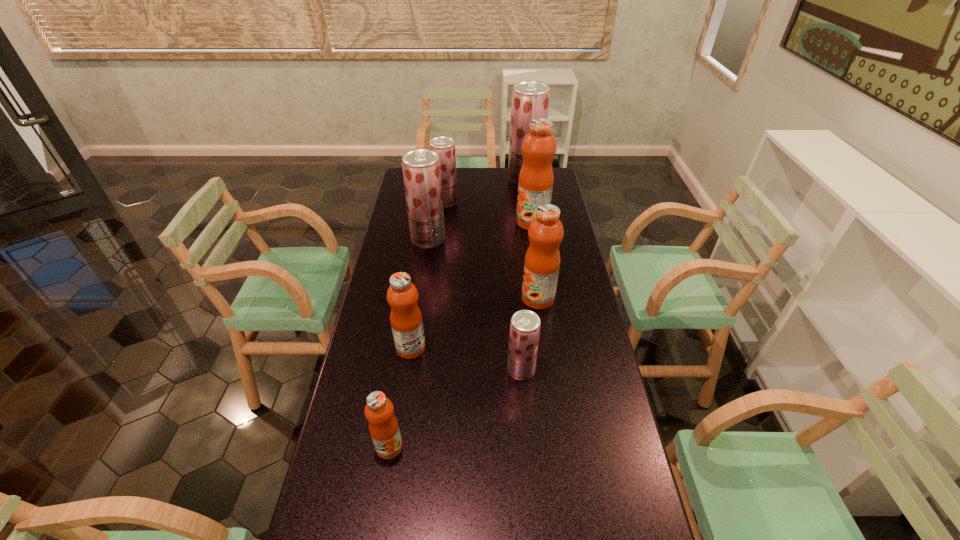
You are a GUI agent. You are given a task and a screenshot of the screen. Output one action in this format:
    pyautogui.click(x=<x>, y=<y>)
    Task: Click on the fruit juice that can be found as the seventh closest to the second biggest strawberry fruit juice
    
    Given the screenshot: What is the action you would take?
    pyautogui.click(x=383, y=425)

Locate an element on the screen. Image resolution: width=960 pixels, height=540 pixels. strawberry fruit juice that is the nearest to the farthest fruit juice is located at coordinates (444, 146).

The width and height of the screenshot is (960, 540). I want to click on strawberry fruit juice that is the fourth closest to the second smallest orange fruit juice, so click(x=530, y=99).

Select which orange fruit juice is the closest to the farthest strawberry fruit juice. Please provide its 2D coordinates. Your answer should be formatted as a tuple, i.e. [(x, y)], where the tuple contains the x and y coordinates of a point satisfying the conditions above.

[(535, 185)]

Find the location of a particular element. the third closest orange fruit juice to the biggest orange fruit juice is located at coordinates (383, 425).

Locate an element on the screen. The height and width of the screenshot is (540, 960). free space that satisfies the following two spatial constraints: 1. on the front side of the nearest strawberry fruit juice; 2. on the left side of the second biggest strawberry fruit juice is located at coordinates pos(409,370).